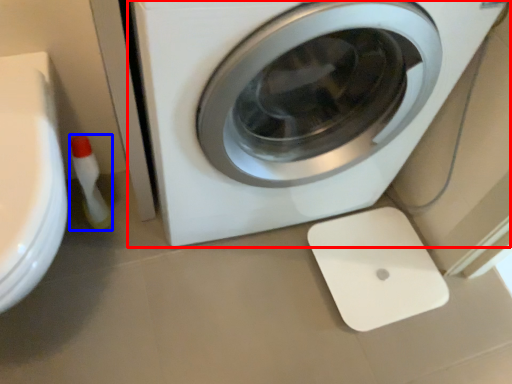
Question: Which object appears farthest to the camera in this image, washing machine (highlighted by a red box) or cleaning product (highlighted by a blue box)?

Choices:
 (A) washing machine
 (B) cleaning product

Answer: (B)